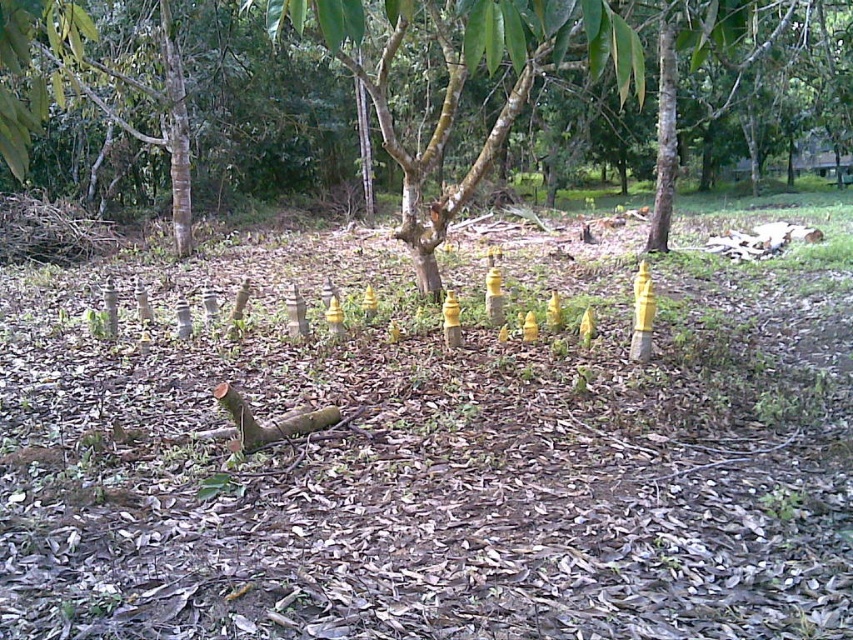
You are a park ranger trying to set up a trail marker in the forest clearing. You have a yellow matte cone at center and a brown rough log at center. Which object is wider and should you avoid placing near the trail path to prevent obstruction?

The brown rough log at center is wider than the yellow matte cone at center. You should avoid placing the brown rough log at center near the trail path to prevent obstruction.

You are standing in the forest clearing and need to locate the smooth bark tree at center. According to the coordinates provided, where exactly would you find it?

The smooth bark tree at center is located at the 2D coordinates point (x=563, y=83).

You are navigating through the forest clearing and need to reach a specific location. You see two points marked as point (137,122) and point (320,426). Which point is closer to you from your current position?

Point (320,426) is closer to you because point (137,122) is behind it.